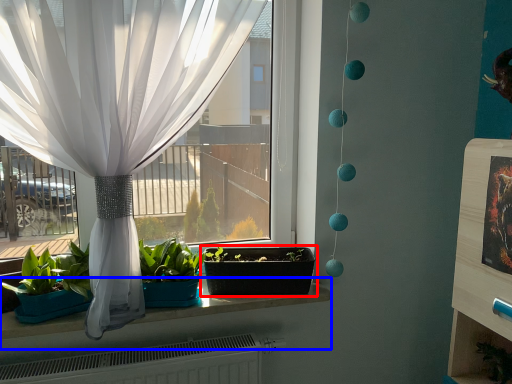
Question: Which object appears farthest to the camera in this image, flowerpot (highlighted by a red box) or window sill (highlighted by a blue box)?

Choices:
 (A) flowerpot
 (B) window sill

Answer: (A)